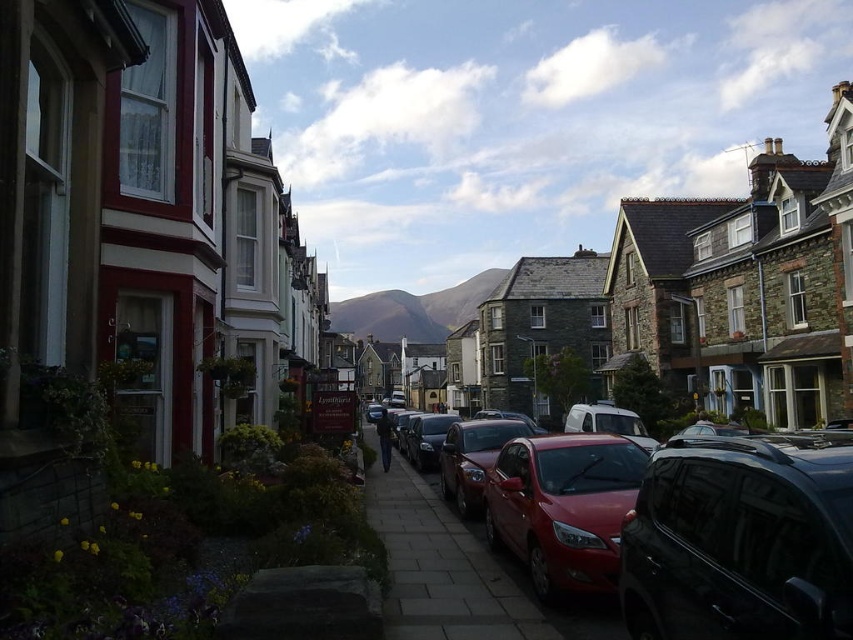
Question: Which point is closer to the camera?

Choices:
 (A) glossy red car at center
 (B) shiny red sedan at center
 (C) paved stone sidewalk at center

Answer: (B)

Question: Which point is farther to the camera?

Choices:
 (A) [547, 493]
 (B) [418, 484]
 (C) [490, 445]
 (D) [759, 550]

Answer: (B)

Question: Does paved stone sidewalk at center have a larger size compared to shiny red car at center?

Choices:
 (A) no
 (B) yes

Answer: (B)

Question: Is glossy red car at center above shiny red car at center?

Choices:
 (A) yes
 (B) no

Answer: (A)

Question: Which object appears farthest from the camera in this image?

Choices:
 (A) shiny red sedan at center
 (B) glossy red car at center
 (C) glossy black car at lower right
 (D) paved stone sidewalk at center

Answer: (B)

Question: Does glossy black car at lower right have a larger size compared to shiny red car at center?

Choices:
 (A) no
 (B) yes

Answer: (A)